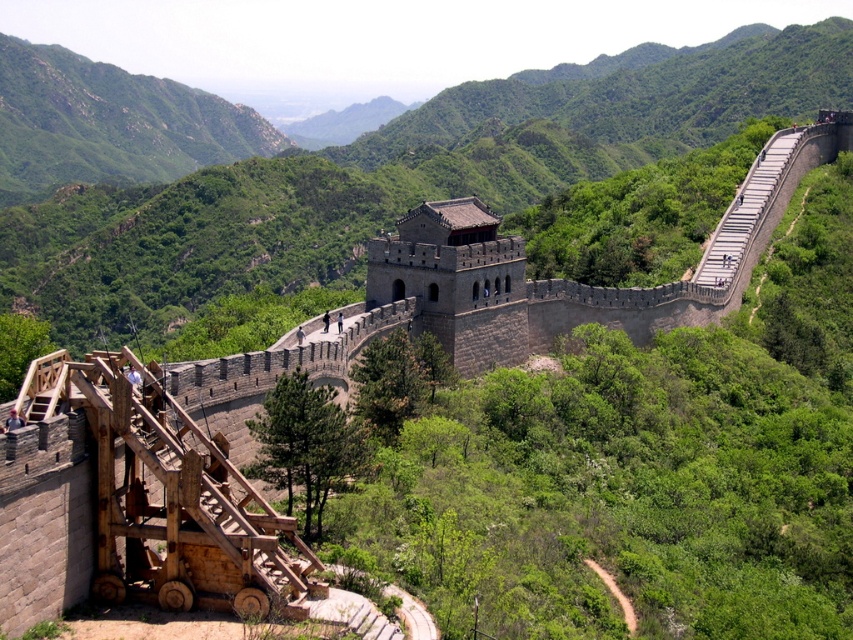
You are standing at the base of the Great Wall and want to reach the watchtower at the center. Which direction should you head from the wooden staircase at lower left to reach the watchtower at the center?

The wooden staircase at lower left is located at point (193, 513), so you should head towards the center of the image from the wooden staircase at lower left to reach the watchtower at the center.

You are a tourist standing at the base of the Great Wall and want to reach the watchtower at the center. You see a wooden staircase at lower left and a gray stone staircase at upper right. Which staircase is closer to your current position?

The wooden staircase at lower left is closer to your current position because it is to the left of the gray stone staircase at upper right, which is further away.

You are standing at the point marked as point (103,538) on the Great Wall of China. You want to take a photo of the entire wall and the watchtower. If your camera has a maximum range of 40 meters, will you be able to capture the entire structure in one shot?

The distance between point (103,538) and the camera is 40.01 meters. Since the camera can only capture up to 40 meters, you will not be able to capture the entire structure in one shot.